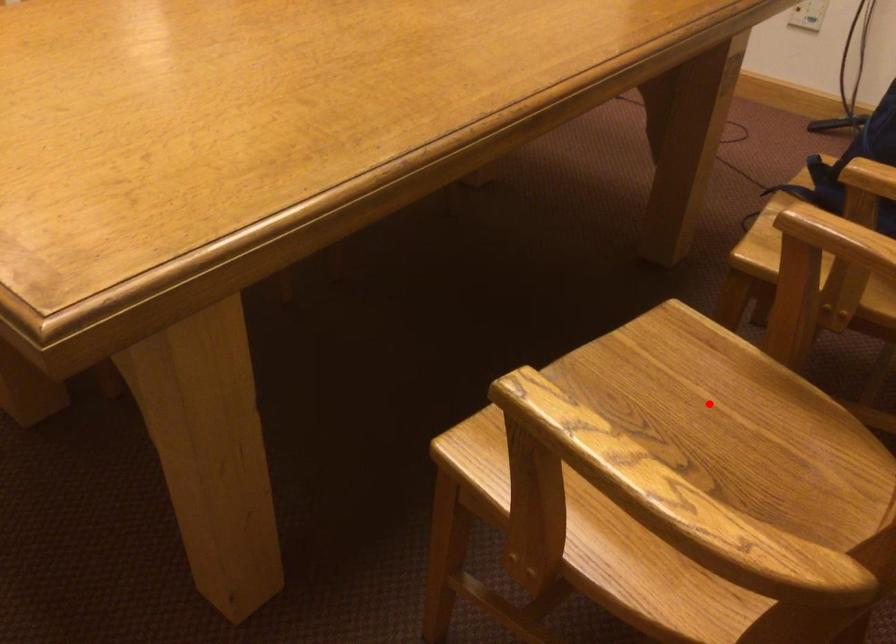
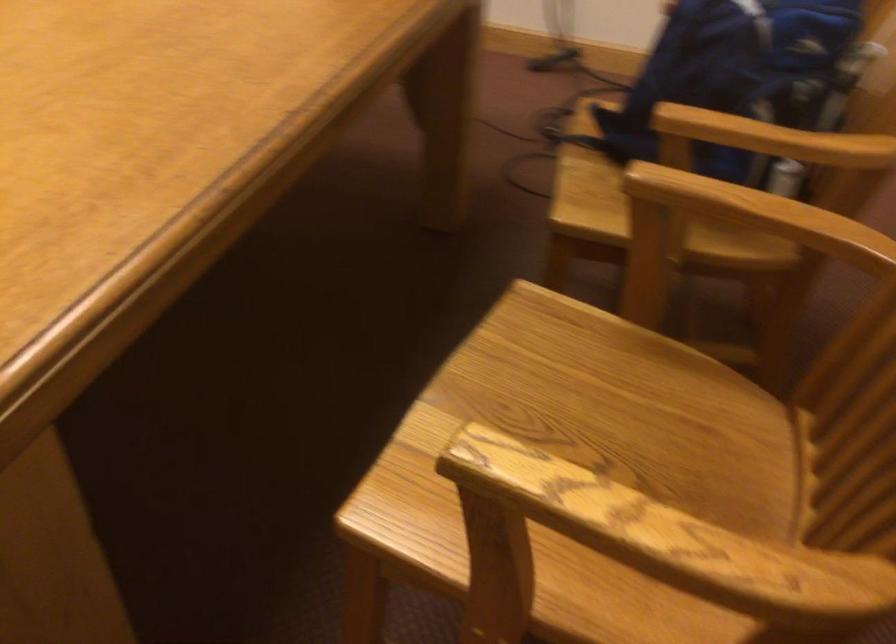
Locate, in the second image, the point that corresponds to the highlighted location in the first image.

(595, 386)